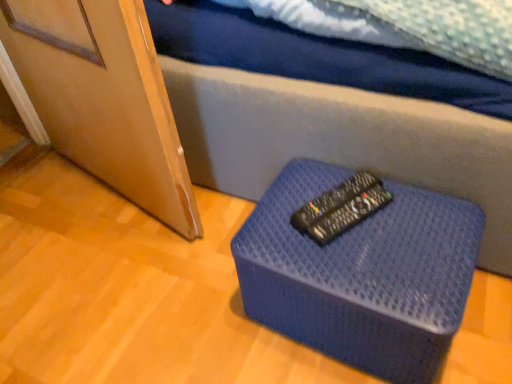
Identify the location of free area behind black plastic remote at center. This screenshot has width=512, height=384. (320, 173).